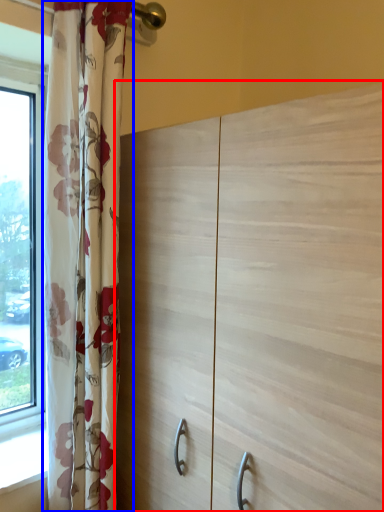
Question: Which object is closer to the camera taking this photo, cupboard (highlighted by a red box) or curtain (highlighted by a blue box)?

Choices:
 (A) cupboard
 (B) curtain

Answer: (A)